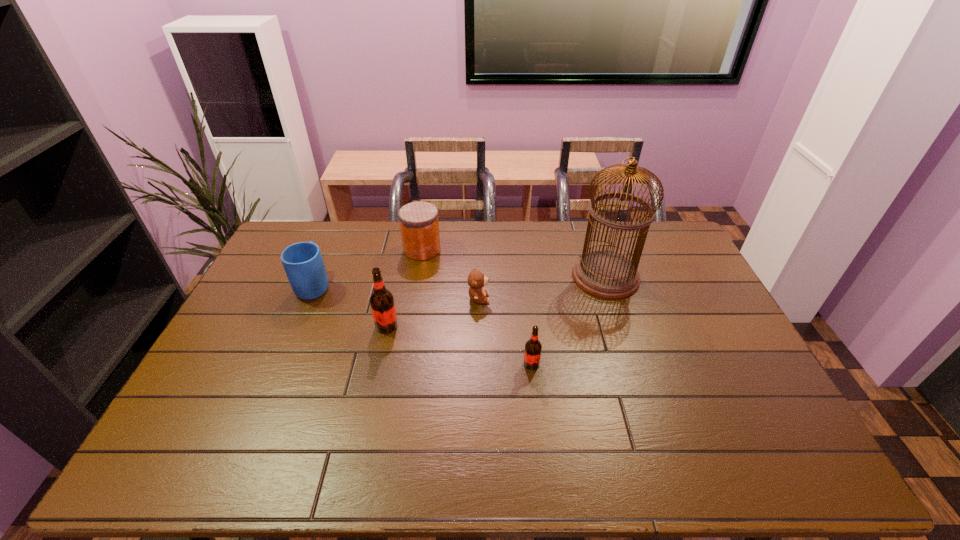
In the current image, all root beers are evenly spaced. To maintain this equal spacing, where should an additional root beer be placed on the right? Please point out a free spot. Please provide its 2D coordinates. Your answer should be formatted as a tuple, i.e. [(x, y)], where the tuple contains the x and y coordinates of a point satisfying the conditions above.

[(704, 409)]